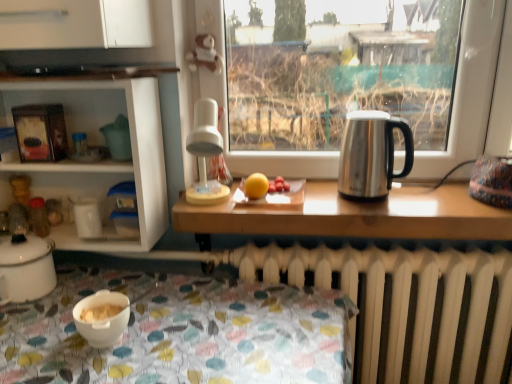
At what (x,y) coordinates should I click in order to perform the action: click on free point above stainless steel kettle at right (from a real-world perspective). Please return your answer as a coordinate pair (x, y). The width and height of the screenshot is (512, 384). Looking at the image, I should click on (367, 115).